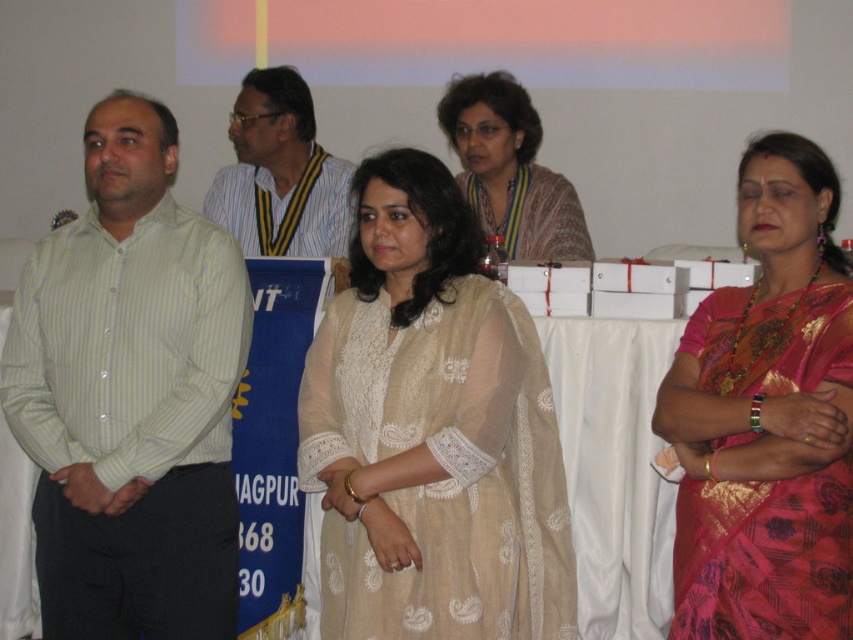
Does beige lace dress at center appear under green striped shirt at left?

Yes.

Is beige lace dress at center to the right of green striped shirt at left from the viewer's perspective?

Yes, beige lace dress at center is to the right of green striped shirt at left.

Identify the location of beige lace dress at center. (431, 432).

Can you confirm if green striped shirt at left is positioned below matte beige dress at center?

Correct, green striped shirt at left is located below matte beige dress at center.

Does green striped shirt at left appear on the right side of matte beige dress at center?

Incorrect, green striped shirt at left is not on the right side of matte beige dress at center.

Locate an element on the screen. The height and width of the screenshot is (640, 853). green striped shirt at left is located at coordinates (131, 396).

At what (x,y) coordinates should I click in order to perform the action: click on green striped shirt at left. Please return your answer as a coordinate pair (x, y). Image resolution: width=853 pixels, height=640 pixels. Looking at the image, I should click on (131, 396).

Between beige lace dress at center and matte striped shirt at left, which one appears on the left side from the viewer's perspective?

Positioned to the left is matte striped shirt at left.

Is beige lace dress at center wider than matte striped shirt at left?

Yes.

Locate an element on the screen. The image size is (853, 640). beige lace dress at center is located at coordinates (431, 432).